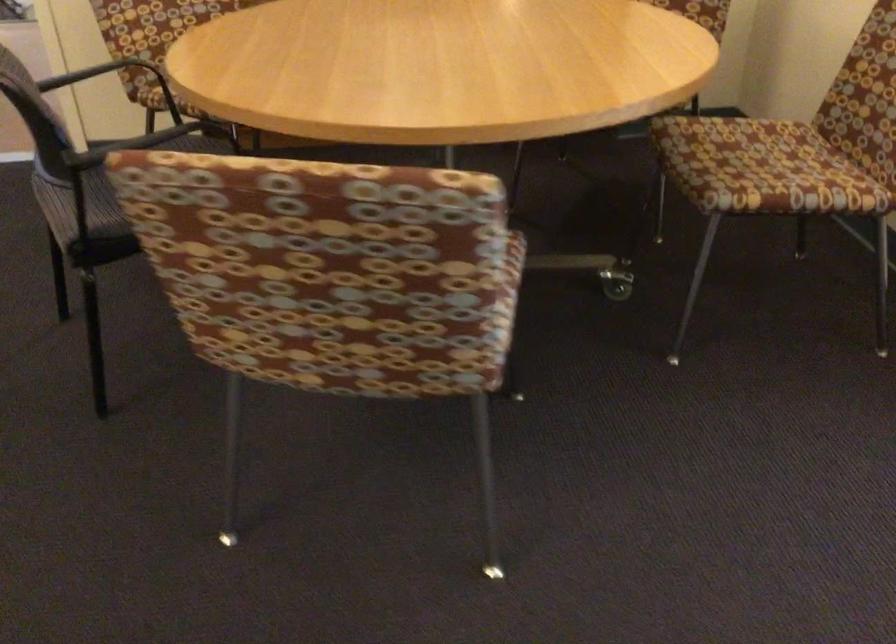
What do you see at coordinates (100, 203) in the screenshot? I see `the black chair sitting surface` at bounding box center [100, 203].